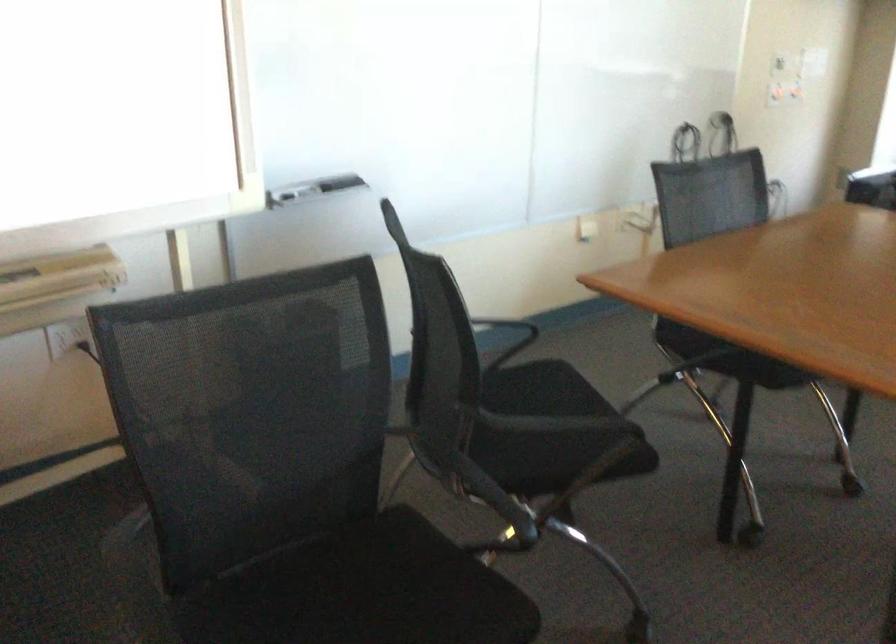
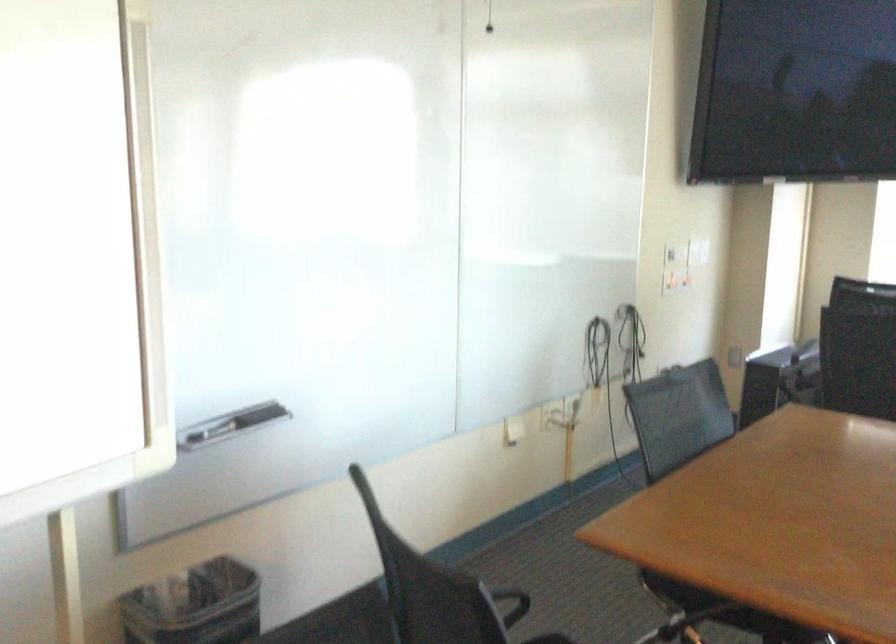
Question: How did the camera likely rotate?

Choices:
 (A) Left
 (B) Right
 (C) Up
 (D) Down

Answer: (C)